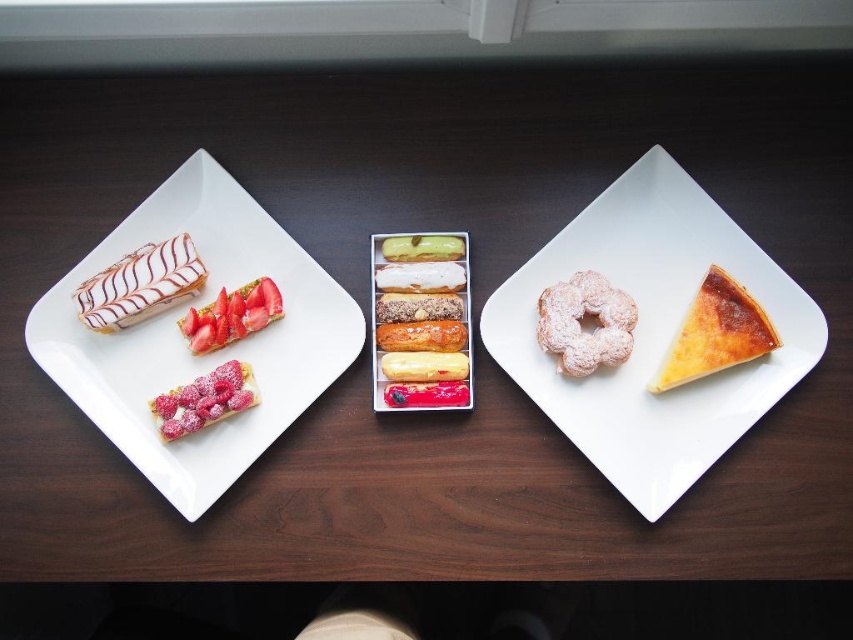
Question: Is smooth yellow cream puff at center thinner than smooth cream puff at center?

Choices:
 (A) yes
 (B) no

Answer: (B)

Question: Which of the following is the farthest from the observer?

Choices:
 (A) shiny metallic eclairs at center
 (B) powdered sugar donut at center
 (C) white glossy rectangular plate at upper left

Answer: (A)

Question: Which of the following is the farthest from the observer?

Choices:
 (A) strawberry-topped pastry at upper left
 (B) yellow cream puff at center
 (C) smooth cream puff at center

Answer: (C)

Question: Is smooth cream puff at center wider than green glossy eclair at center?

Choices:
 (A) yes
 (B) no

Answer: (A)

Question: Can you confirm if matte white cream puff at left is bigger than white glossy eclair at center?

Choices:
 (A) no
 (B) yes

Answer: (B)

Question: Which point is closer to the camera?

Choices:
 (A) matte white cream puff at left
 (B) white glossy eclair at center
 (C) smooth yellow cream puff at center

Answer: (A)